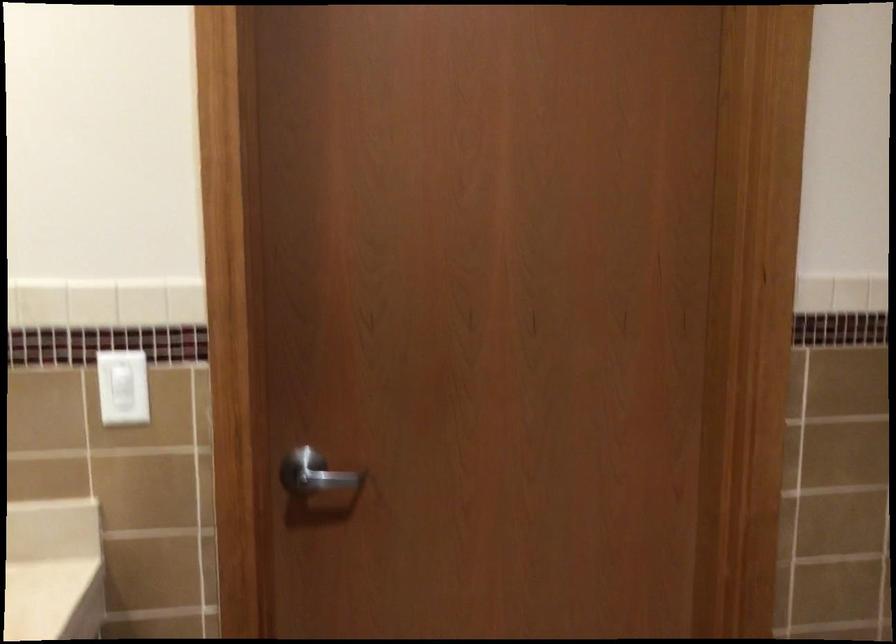
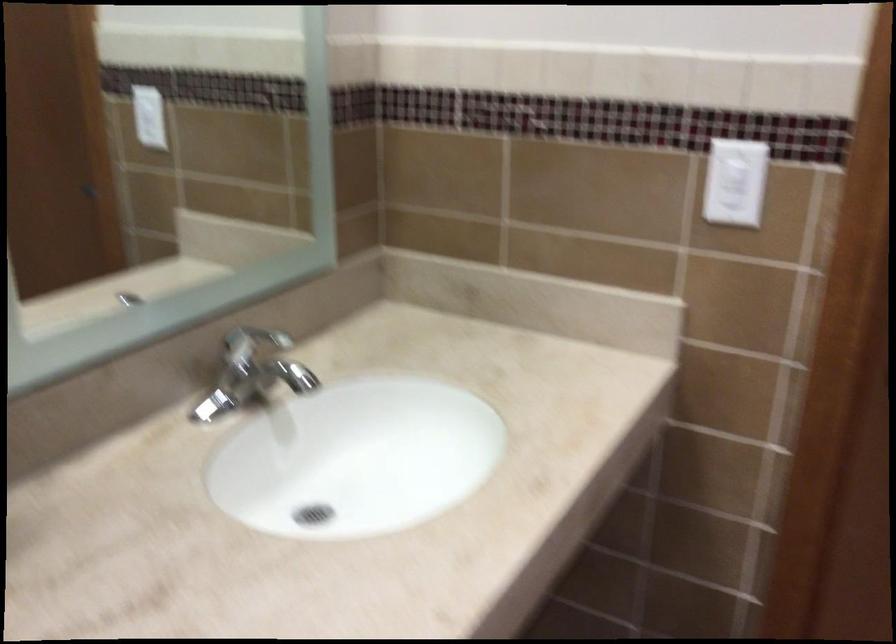
Where in the second image is the point corresponding to the point at 115,393 from the first image?

(736, 182)